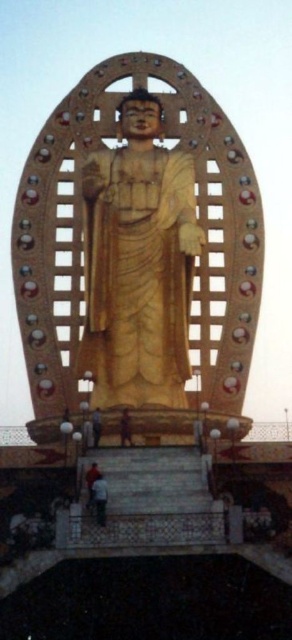
Question: Does orange fabric person at lower center appear over light brown fabric pants at lower center?

Choices:
 (A) no
 (B) yes

Answer: (A)

Question: Is golden wood statue at center positioned behind orange fabric person at lower center?

Choices:
 (A) yes
 (B) no

Answer: (A)

Question: Which point is closer to the camera?

Choices:
 (A) dark brown leather shoes at lower center
 (B) light brown fabric pants at lower center
 (C) orange fabric person at lower left

Answer: (C)

Question: Based on their relative distances, which object is farther from the golden wood statue at center?

Choices:
 (A) orange fabric person at lower left
 (B) light brown fabric pants at lower center
 (C) orange fabric person at lower center

Answer: (A)

Question: Which of the following is the closest to the observer?

Choices:
 (A) light brown fabric pants at lower center
 (B) orange fabric person at lower left

Answer: (B)

Question: Does golden wood statue at center come behind orange fabric person at lower center?

Choices:
 (A) no
 (B) yes

Answer: (B)